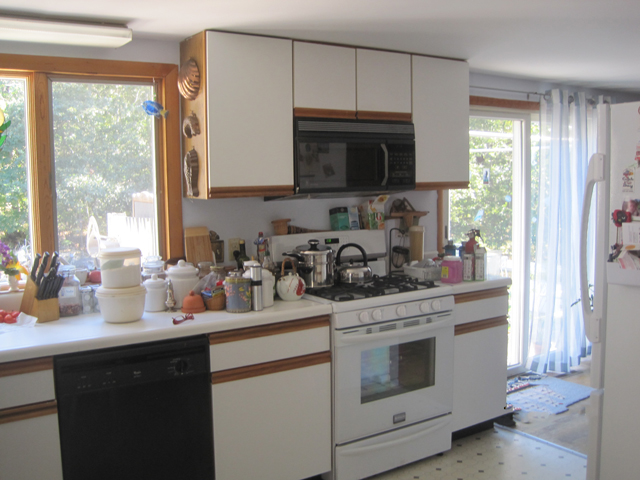
I want to click on dishwasher, so click(x=157, y=426).